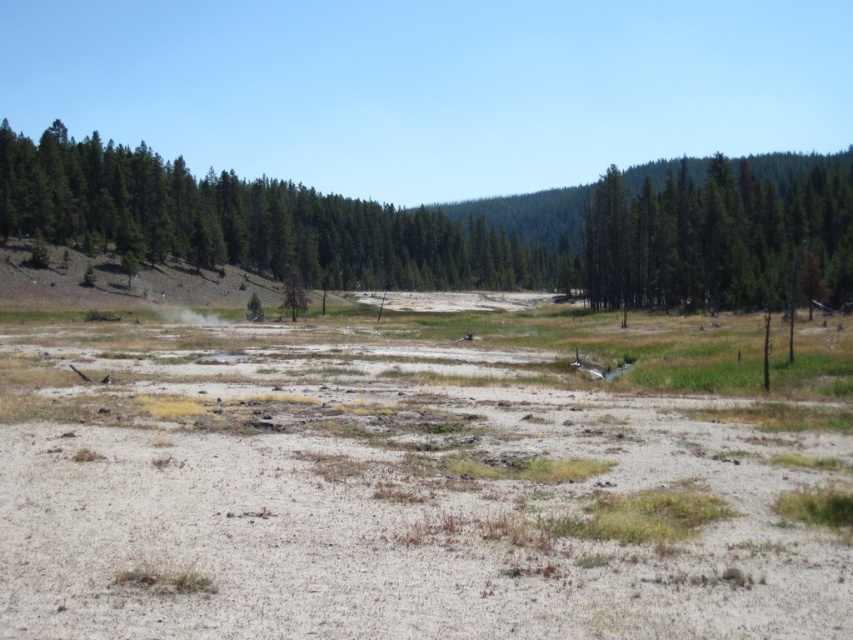
You are standing at the edge of the stream and see the green matte tree at upper right and the white vapor at center. Which object is positioned to the right of the other?

The green matte tree at upper right is to the right of white vapor at center.

You are a hiker trying to cross the terrain in the image. You see the dull gray sand at center and the white vapor at center. Which one is closer to the ground?

The dull gray sand at center is positioned under the white vapor at center, so the sand is closer to the ground.

You are planning to cross the landscape and need to know which area is narrower between the dull gray sand at center and the green matte tree at upper left. Which one should you choose for a narrower path?

The dull gray sand at center has a lesser width compared to the green matte tree at upper left, so you should choose the dull gray sand at center for a narrower path.